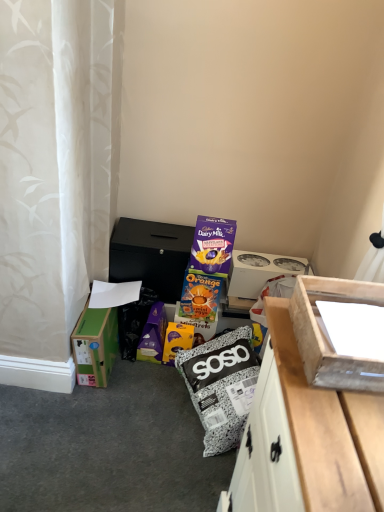
Question: In the image, is green cardboard box at lower left, the first box viewed from the left, positioned in front of or behind white cardboard box at upper right, which is the 1th box from back to front?

Choices:
 (A) behind
 (B) front

Answer: (B)

Question: Would you say green cardboard box at lower left, which appears as the 2th box when viewed from the front, is to the left or to the right of white cardboard box at upper right, marked as the 3th box in a left-to-right arrangement, in the picture?

Choices:
 (A) right
 (B) left

Answer: (B)

Question: Which is nearer to the black matte box at center, the second cardboard box from the bottom?

Choices:
 (A) green cardboard box at lower left, which appears as the 2th box when viewed from the front
 (B) orange cardboard box at center, which is counted as the 2th cardboard box, starting from the top
 (C) white cardboard box at upper right, which is the 1th box from back to front
 (D) wooden box at right, the 3th box positioned from the back

Answer: (A)

Question: Based on their relative distances, which object is farther from the white cardboard box at upper right, which is the 3th box from front to back?

Choices:
 (A) orange cardboard box at center, which is counted as the 2th cardboard box, starting from the top
 (B) wooden box at right, arranged as the second box when viewed from the right
 (C) green cardboard box at lower left, which appears as the second box when viewed from the back
 (D) black matte box at center, marked as the first cardboard box in a top-to-bottom arrangement

Answer: (B)